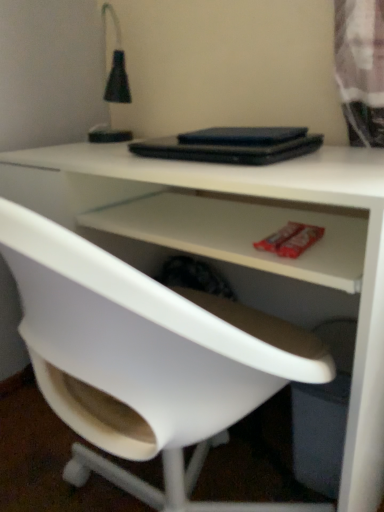
Identify the location of vacant area that lies in front of black matte laptop at center. (265, 168).